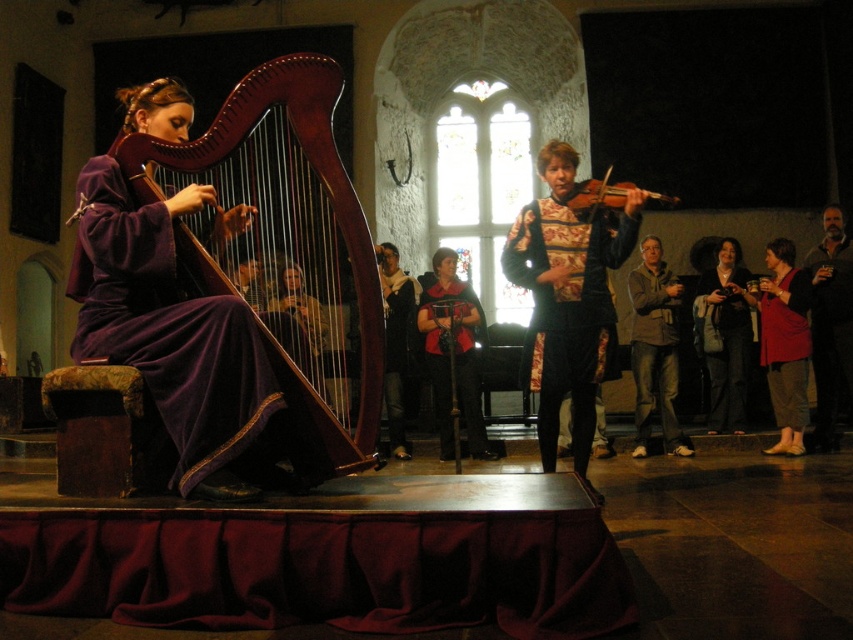
You are a stagehand who needs to place a microphone stand at point (395, 340). There is a dark brown leather jacket at center. Will the microphone stand interfere with the jacket?

The dark brown leather jacket at center is located exactly at point (395, 340), so placing the microphone stand there would interfere with the jacket.

You are an event planner setting up a stage for a classical music performance. The stage has a coordinate system where the bottom left corner is the origin point. You need to place a spotlight at the exact location of the floral brocade robe at right. What are the coordinates where you should position the spotlight?

The coordinates for the floral brocade robe at right are at point (567, 308). Position the spotlight at these coordinates.